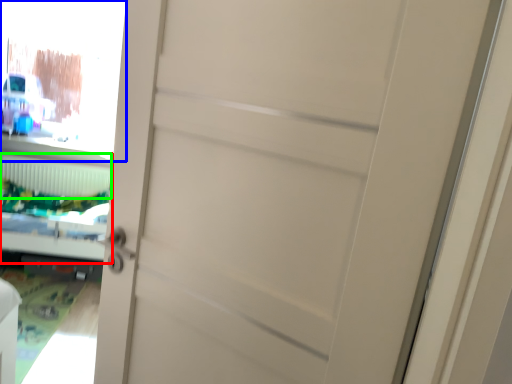
Question: Which is nearer to the bed (highlighted by a red box)? window screen (highlighted by a blue box) or radiator (highlighted by a green box).

Choices:
 (A) window screen
 (B) radiator

Answer: (B)